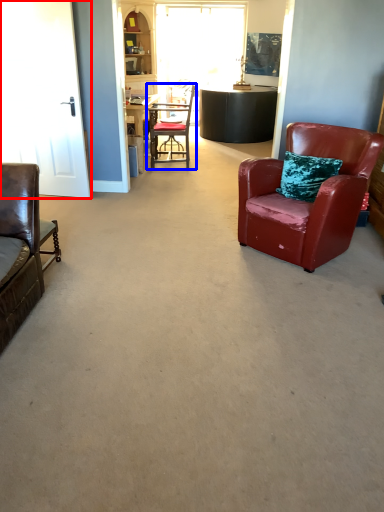
Question: Which of the following is the closest to the observer, glass door (highlighted by a red box) or chair (highlighted by a blue box)?

Choices:
 (A) glass door
 (B) chair

Answer: (A)